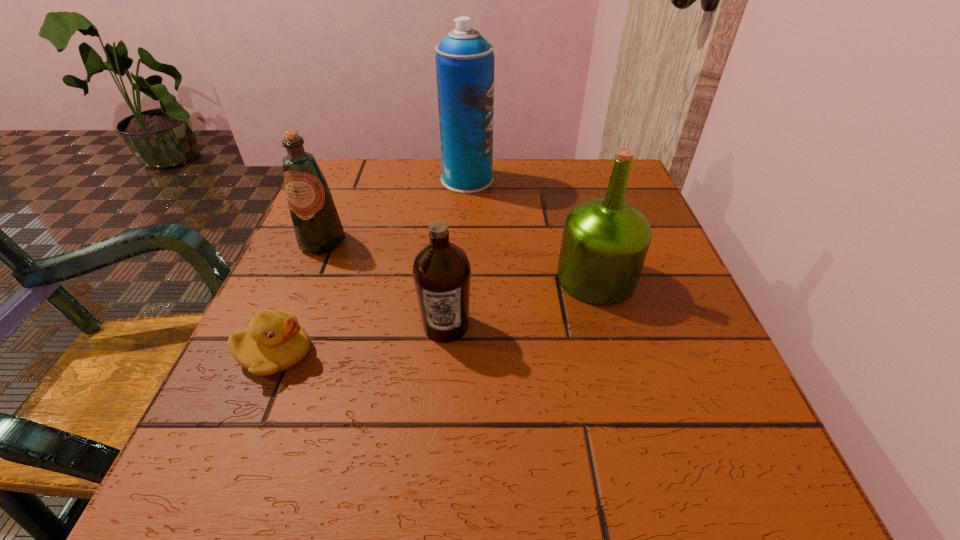
In the image, there is a desktop. Find the location of `free region at the near left corner`. free region at the near left corner is located at coordinates (240, 492).

Find the location of `vacant space at the far right corner of the desktop`. vacant space at the far right corner of the desktop is located at coordinates (632, 201).

The image size is (960, 540). I want to click on vacant area between the aerosol can and the leftmost olive oil, so click(395, 211).

At what (x,y) coordinates should I click in order to perform the action: click on free space between the second olive oil from left to right and the rightmost olive oil. Please return your answer as a coordinate pair (x, y). This screenshot has height=540, width=960. Looking at the image, I should click on (521, 302).

Find the location of a particular element. empty location between the second olive oil from left to right and the rightmost olive oil is located at coordinates (521, 302).

Where is `free space between the leftmost olive oil and the second olive oil from right to left`? The image size is (960, 540). free space between the leftmost olive oil and the second olive oil from right to left is located at coordinates (384, 284).

Image resolution: width=960 pixels, height=540 pixels. Find the location of `free area in between the aerosol can and the rightmost object`. free area in between the aerosol can and the rightmost object is located at coordinates (532, 229).

Find the location of `empty space that is in between the leftmost olive oil and the shortest object`. empty space that is in between the leftmost olive oil and the shortest object is located at coordinates (300, 298).

Locate an element on the screen. vacant space that's between the leftmost olive oil and the second olive oil from right to left is located at coordinates (384, 284).

Identify which object is the third closest to the aerosol can. Please provide its 2D coordinates. Your answer should be formatted as a tuple, i.e. [(x, y)], where the tuple contains the x and y coordinates of a point satisfying the conditions above.

[(441, 271)]